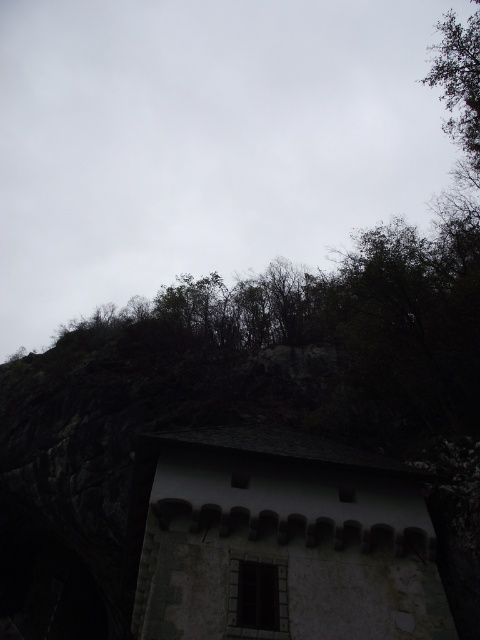
Question: Does white stone hut at center appear on the right side of gray slate roof at upper center?

Choices:
 (A) yes
 (B) no

Answer: (A)

Question: Considering the relative positions of white stone hut at center and gray slate roof at upper center in the image provided, where is white stone hut at center located with respect to gray slate roof at upper center?

Choices:
 (A) below
 (B) above

Answer: (A)

Question: Which point is closer to the camera?

Choices:
 (A) gray slate roof at upper center
 (B) white stone hut at center

Answer: (B)

Question: Can you confirm if white stone hut at center is smaller than gray slate roof at upper center?

Choices:
 (A) no
 (B) yes

Answer: (A)